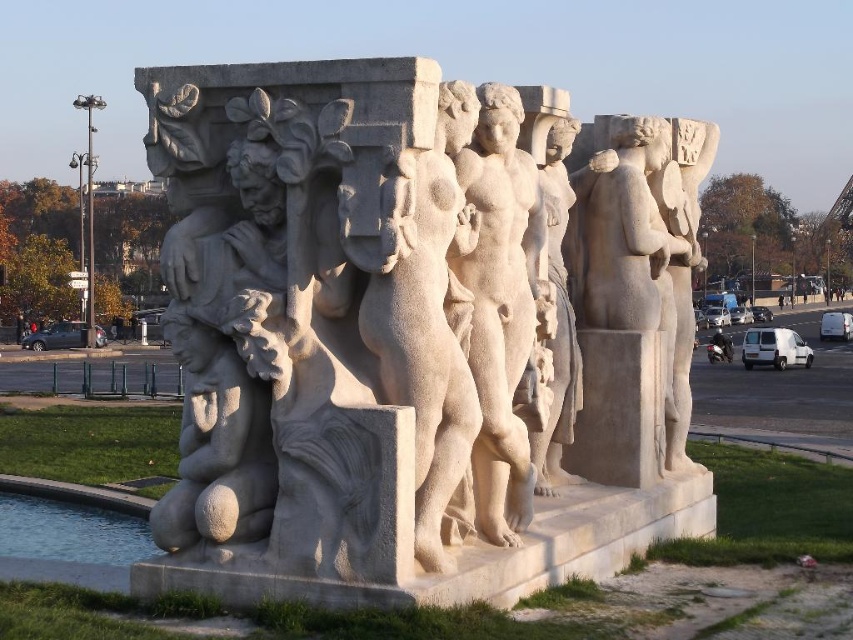
Question: Which point is closer to the camera?

Choices:
 (A) (344, 129)
 (B) (489, 179)
 (C) (163, 536)

Answer: (A)

Question: Can you confirm if white stone sculpture at center is positioned below smooth stone statue at center?

Choices:
 (A) yes
 (B) no

Answer: (A)

Question: Does smooth stone statue at center appear under matte stone figure at lower left?

Choices:
 (A) yes
 (B) no

Answer: (B)

Question: Which point appears farthest from the camera in this image?

Choices:
 (A) (323, 244)
 (B) (502, 518)
 (C) (254, 460)

Answer: (B)

Question: Observing the image, what is the correct spatial positioning of smooth stone statue at center in reference to matte stone figure at lower left?

Choices:
 (A) above
 (B) below

Answer: (A)

Question: Which of the following is the farthest from the observer?

Choices:
 (A) (479, 161)
 (B) (190, 188)

Answer: (A)